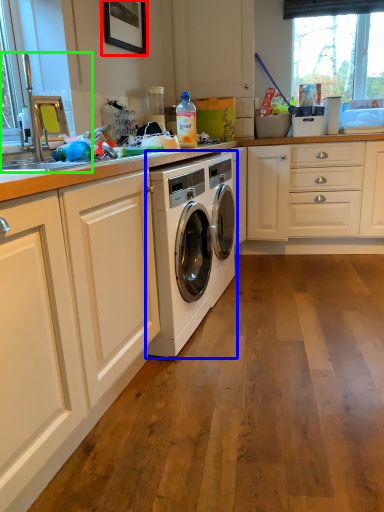
Question: Which is farther away from picture frame (highlighted by a red box)? washing machine (highlighted by a blue box) or sink (highlighted by a green box)?

Choices:
 (A) washing machine
 (B) sink

Answer: (A)